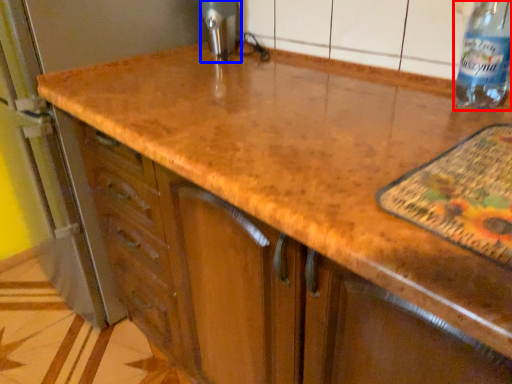
Question: Which object is closer to the camera taking this photo, bottle (highlighted by a red box) or appliance (highlighted by a blue box)?

Choices:
 (A) bottle
 (B) appliance

Answer: (A)